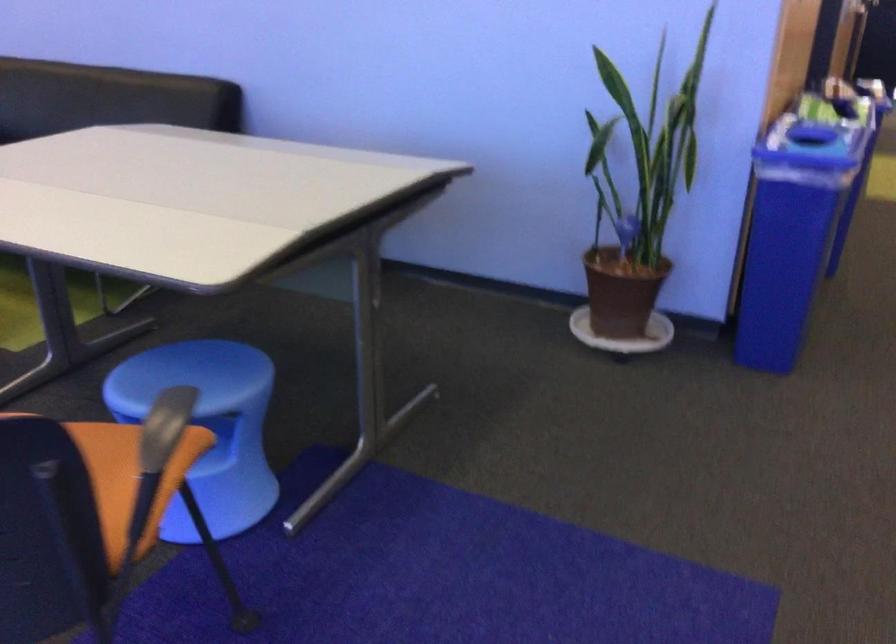
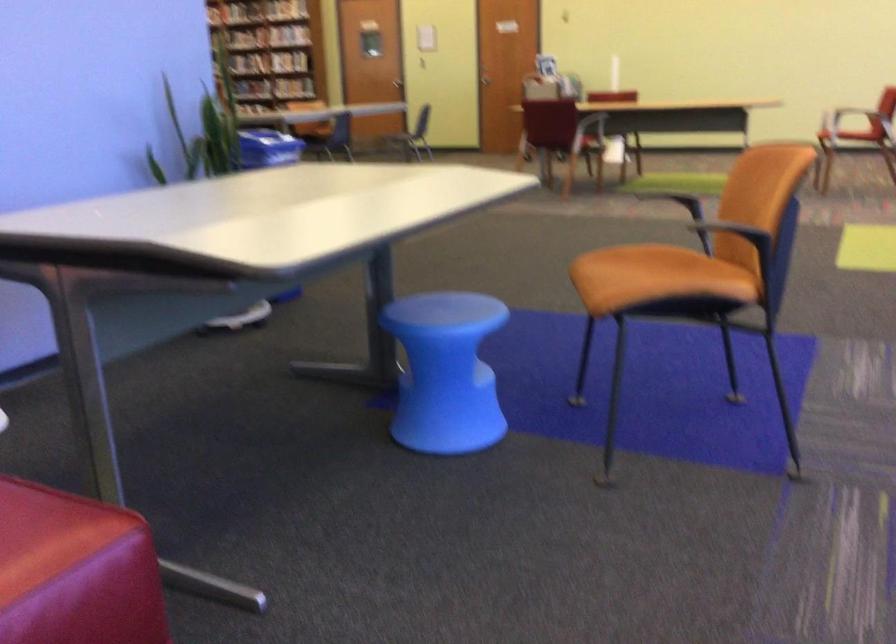
The point at (x=736, y=156) is marked in the first image. Where is the corresponding point in the second image?

(268, 147)